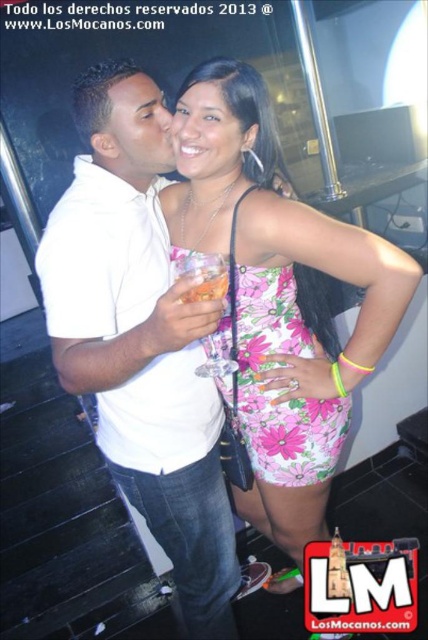
You are a photographer standing in front of the scene. You want to take a photo of both the white matte shirt at center and the pink floral dress at center. Which one should you focus on first to ensure both are in clear focus?

You should focus on the white matte shirt at center first because it is closer to the viewer than the pink floral dress at center. By focusing on the closer object, the depth of field may allow the farther object to also be in focus.